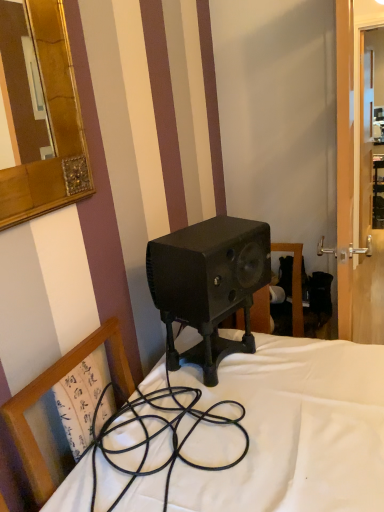
Where is `empty space that is ontop of matte black speaker at center`? The height and width of the screenshot is (512, 384). empty space that is ontop of matte black speaker at center is located at coordinates (216, 230).